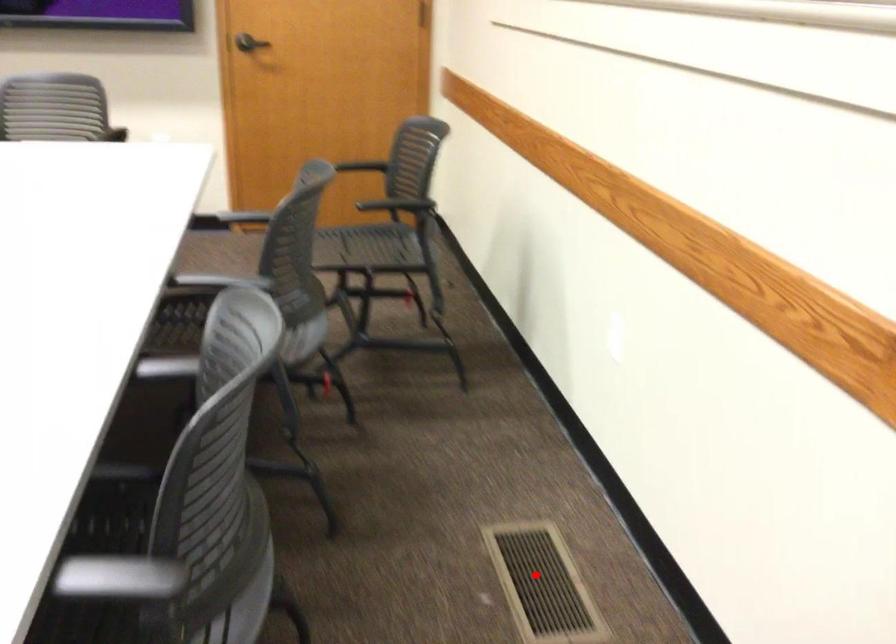
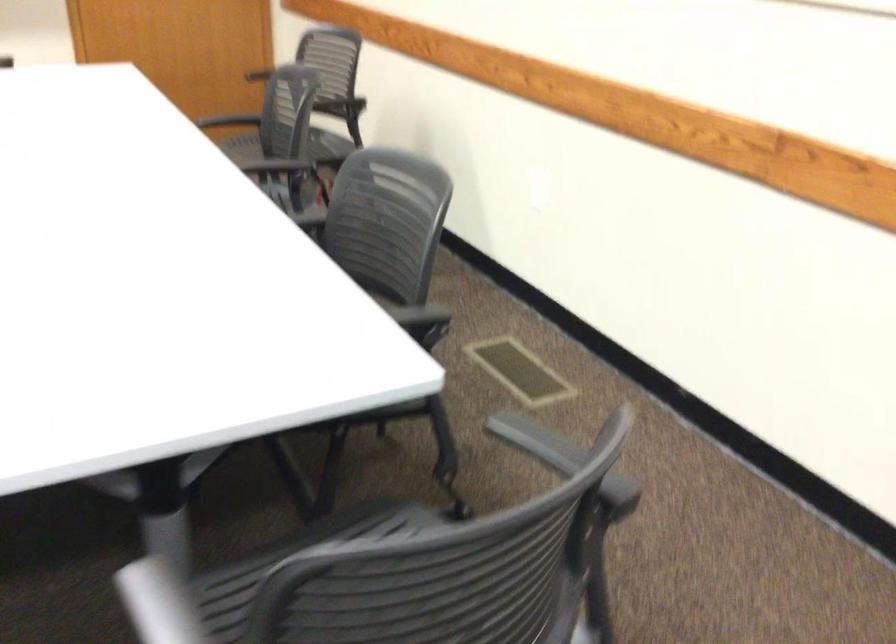
Question: I am providing you with two images of the same scene from different viewpoints. A red point is shown in image1. For the corresponding object point in image2, is it positioned nearer or farther from the camera?

Choices:
 (A) Nearer
 (B) Farther

Answer: (B)